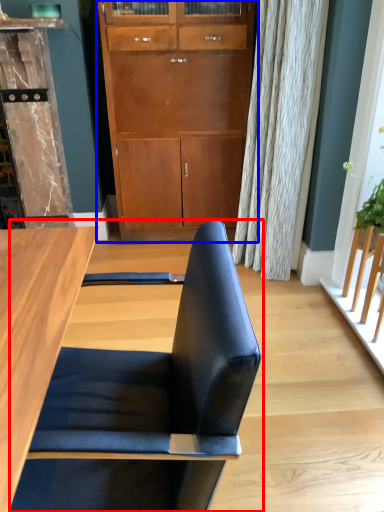
Question: Among these objects, which one is nearest to the camera, chair (highlighted by a red box) or cabinetry (highlighted by a blue box)?

Choices:
 (A) chair
 (B) cabinetry

Answer: (A)